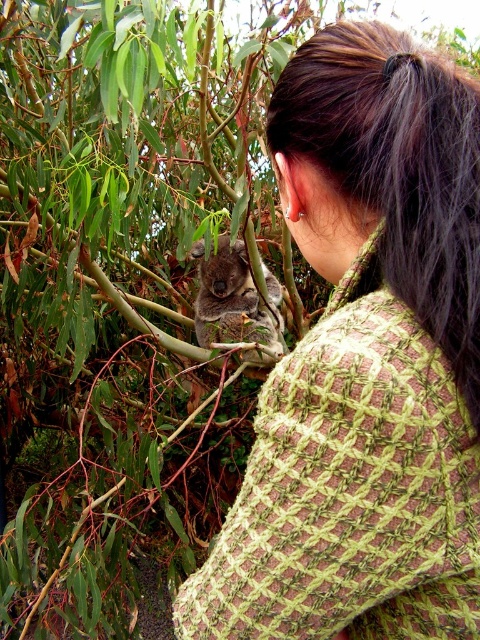
Question: Which point appears farthest from the camera in this image?

Choices:
 (A) (242, 296)
 (B) (345, 604)

Answer: (A)

Question: From the image, what is the correct spatial relationship of linen green shawl at upper right in relation to gray furry koala at upper center?

Choices:
 (A) above
 (B) below

Answer: (B)

Question: Which point is closer to the camera taking this photo?

Choices:
 (A) (463, 529)
 (B) (236, 332)

Answer: (A)

Question: Does linen green shawl at upper right have a greater width compared to gray furry koala at upper center?

Choices:
 (A) no
 (B) yes

Answer: (A)

Question: Which object is closer to the camera taking this photo?

Choices:
 (A) linen green shawl at upper right
 (B) gray furry koala at upper center

Answer: (A)

Question: In this image, where is linen green shawl at upper right located relative to gray furry koala at upper center?

Choices:
 (A) right
 (B) left

Answer: (A)